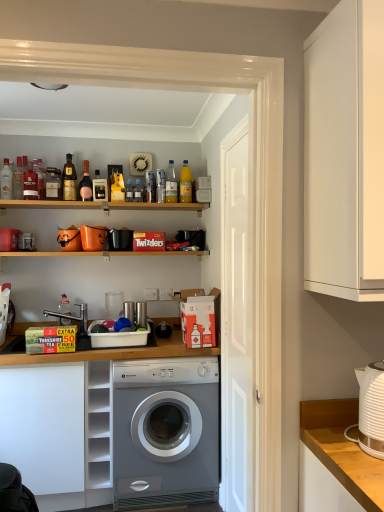
Question: Relative to white plastic kettle at right, which appears as the fourth appliance when viewed from the left, is white plastic dish rack at center, arranged as the 3th appliance when viewed from the right, in front or behind?

Choices:
 (A) front
 (B) behind

Answer: (B)

Question: Visually, is white plastic dish rack at center, arranged as the 3th appliance when viewed from the right, positioned to the left or to the right of white plastic kettle at right, placed as the 4th appliance when sorted from back to front?

Choices:
 (A) right
 (B) left

Answer: (B)

Question: Which of these objects is positioned closest to the white glossy sink at lower left?

Choices:
 (A) yellow matte bottle at upper center, which ranks as the 2th bottle in right-to-left order
 (B) silver metallic washing machine at center
 (C) white plastic kettle at right, which is counted as the first appliance, starting from the front
 (D) metallic silver washing machine at center, the 2th appliance in the right-to-left sequence
 (E) matte black kettle at left, acting as the fourth appliance starting from the right

Answer: (E)

Question: Estimate the real-world distances between objects in this image. Which object is farther from the brushed metal soap dispenser at lower left, which appears as the seventh bottle when viewed from the right?

Choices:
 (A) matte glass wine bottle at upper left, positioned as the eighth bottle in right-to-left order
 (B) silver metallic washing machine at center
 (C) yellow glass bottle at upper center, the ninth bottle from the left
 (D) white matte door at center
 (E) yellow cardboard box at lower left

Answer: (D)